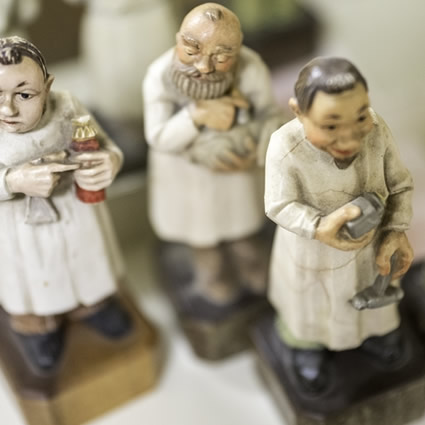
Where is `bottles`? bottles is located at coordinates (81, 137), (369, 221).